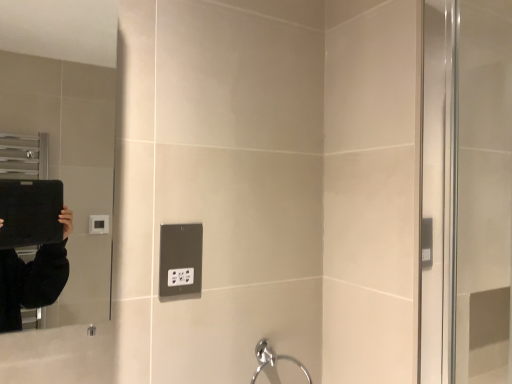
Question: Is black plastic outlet at center located within matte black mirror at left?

Choices:
 (A) no
 (B) yes

Answer: (A)

Question: Is matte black mirror at left wider than black plastic outlet at center?

Choices:
 (A) no
 (B) yes

Answer: (B)

Question: Is matte black mirror at left turned away from black plastic outlet at center?

Choices:
 (A) no
 (B) yes

Answer: (A)

Question: From the image's perspective, is matte black mirror at left located above black plastic outlet at center?

Choices:
 (A) yes
 (B) no

Answer: (A)

Question: Is matte black mirror at left taller than black plastic outlet at center?

Choices:
 (A) yes
 (B) no

Answer: (A)

Question: Is point (303, 370) positioned closer to the camera than point (62, 82)?

Choices:
 (A) farther
 (B) closer

Answer: (B)

Question: Is chrome metallic faucet at lower center situated inside matte black mirror at left or outside?

Choices:
 (A) inside
 (B) outside

Answer: (B)

Question: Considering the positions of chrome metallic faucet at lower center and matte black mirror at left in the image, is chrome metallic faucet at lower center wider or thinner than matte black mirror at left?

Choices:
 (A) wide
 (B) thin

Answer: (B)

Question: From a real-world perspective, relative to matte black mirror at left, is chrome metallic faucet at lower center vertically above or below?

Choices:
 (A) below
 (B) above

Answer: (A)

Question: Would you say black plastic outlet at center is to the left or to the right of matte black mirror at left in the picture?

Choices:
 (A) right
 (B) left

Answer: (A)

Question: Does point (196, 248) appear closer or farther from the camera than point (91, 74)?

Choices:
 (A) farther
 (B) closer

Answer: (B)

Question: From the image's perspective, is black plastic outlet at center above or below matte black mirror at left?

Choices:
 (A) above
 (B) below

Answer: (B)

Question: Is black plastic outlet at center bigger or smaller than matte black mirror at left?

Choices:
 (A) big
 (B) small

Answer: (B)

Question: Considering the positions of black plastic outlet at center and chrome metallic faucet at lower center in the image, is black plastic outlet at center taller or shorter than chrome metallic faucet at lower center?

Choices:
 (A) tall
 (B) short

Answer: (B)

Question: Visually, is black plastic outlet at center positioned to the left or to the right of chrome metallic faucet at lower center?

Choices:
 (A) left
 (B) right

Answer: (A)